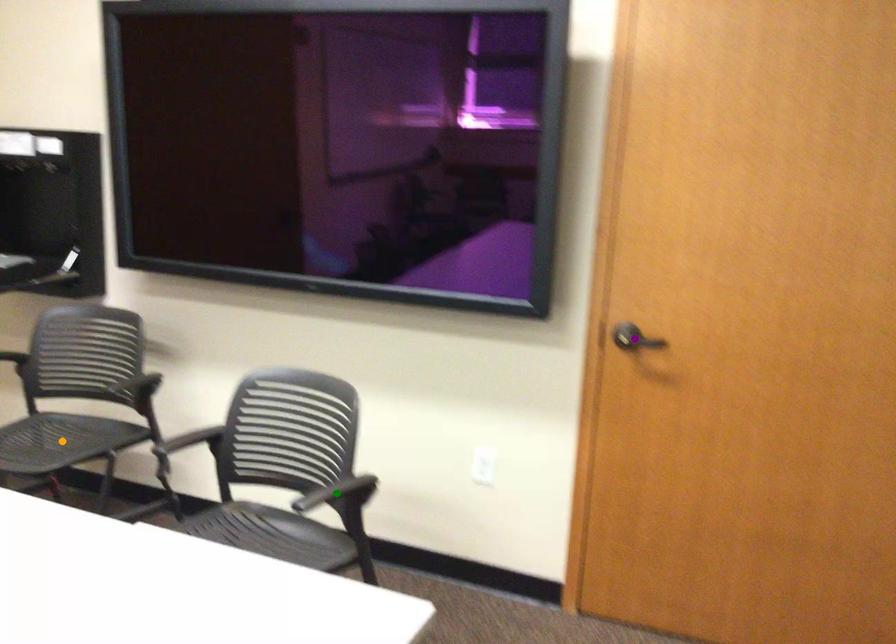
Order these from nearest to farthest:
purple point
orange point
green point

green point → purple point → orange point